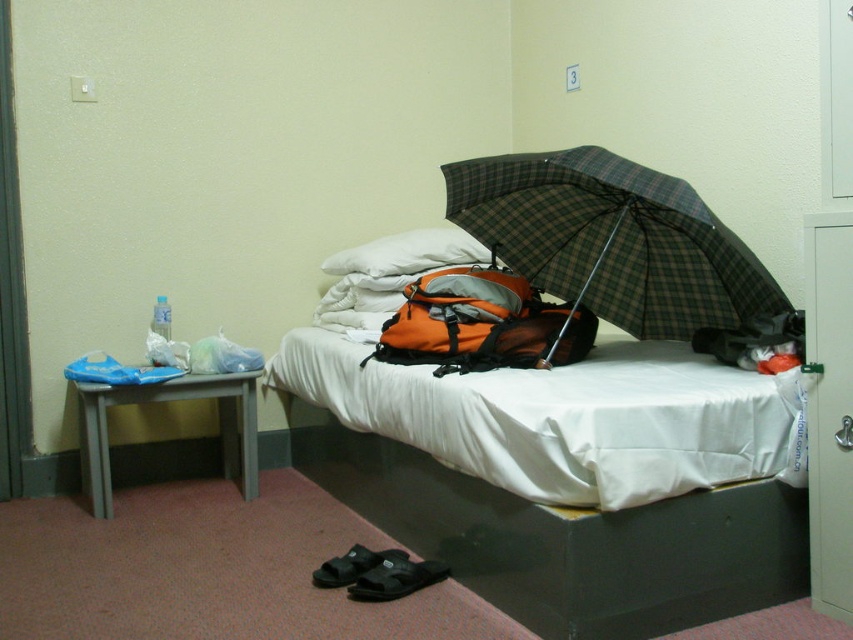
Based on the photo, does white fabric bed at center have a smaller size compared to black fabric sandals at lower center?

No.

Between white fabric bed at center and black fabric sandals at lower center, which one appears on the left side from the viewer's perspective?

black fabric sandals at lower center is more to the left.

Who is more distant from viewer, (708, 545) or (358, 563)?

Point (358, 563)

Find the location of a particular element. white fabric bed at center is located at coordinates (560, 472).

Can you confirm if orange fabric backpack at center is shorter than black fabric sandals at lower center?

Incorrect, orange fabric backpack at center's height does not fall short of black fabric sandals at lower center's.

Is orange fabric backpack at center to the right of black fabric sandals at lower center from the viewer's perspective?

Indeed, orange fabric backpack at center is positioned on the right side of black fabric sandals at lower center.

This screenshot has width=853, height=640. What are the coordinates of `orange fabric backpack at center` in the screenshot? It's located at (482, 324).

Does white fabric mattress at center lie behind black fabric sandals at lower center?

No, it is not.

This screenshot has height=640, width=853. What do you see at coordinates (566, 417) in the screenshot? I see `white fabric mattress at center` at bounding box center [566, 417].

Is point (480, 397) closer to viewer compared to point (399, 548)?

Yes, point (480, 397) is closer to viewer.

Image resolution: width=853 pixels, height=640 pixels. Find the location of `white fabric mattress at center`. white fabric mattress at center is located at coordinates (566, 417).